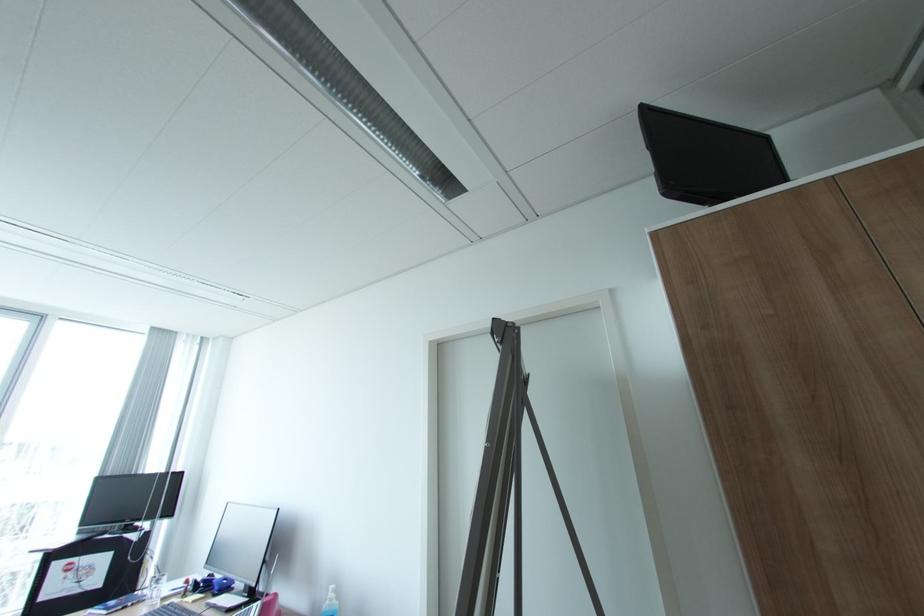
The width and height of the screenshot is (924, 616). In order to click on blue tape dispenser in this screenshot , I will do `click(222, 585)`.